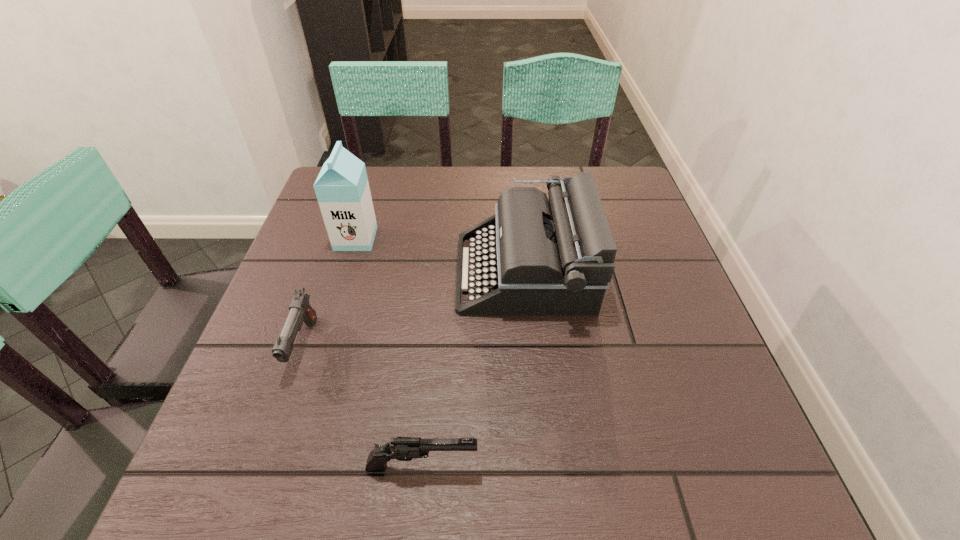
At what (x,y) coordinates should I click in order to perform the action: click on free spot at the near right corner of the desktop. Please return your answer as a coordinate pair (x, y). This screenshot has width=960, height=540. Looking at the image, I should click on click(681, 448).

Identify the location of unoccupied area between the third shortest object and the nearer gun. This screenshot has width=960, height=540. (473, 369).

Locate an element on the screen. Image resolution: width=960 pixels, height=540 pixels. free point between the third shortest object and the right gun is located at coordinates (473, 369).

You are a GUI agent. You are given a task and a screenshot of the screen. Output one action in this format:
    pyautogui.click(x=<x>, y=<y>)
    Task: Click on the free space between the typewriter and the tallest object
    This screenshot has width=960, height=540.
    Given the screenshot: What is the action you would take?
    pyautogui.click(x=440, y=255)

You are a GUI agent. You are given a task and a screenshot of the screen. Output one action in this format:
    pyautogui.click(x=<x>, y=<y>)
    Task: Click on the vacant region between the farther gun and the nearer gun
    
    Given the screenshot: What is the action you would take?
    [363, 406]

Where is `unoccupied area between the left gun and the typewriter`? unoccupied area between the left gun and the typewriter is located at coordinates (414, 309).

Where is `free spot between the farther gun and the second tallest object`? The height and width of the screenshot is (540, 960). free spot between the farther gun and the second tallest object is located at coordinates (414, 309).

Image resolution: width=960 pixels, height=540 pixels. Find the location of `free point between the nearer gun and the milk carton`. free point between the nearer gun and the milk carton is located at coordinates (389, 353).

Where is `vacant point located between the left gun and the typewriter`? The width and height of the screenshot is (960, 540). vacant point located between the left gun and the typewriter is located at coordinates (414, 309).

Identify the location of vacant space that's between the right gun and the left gun. The height and width of the screenshot is (540, 960). (363, 406).